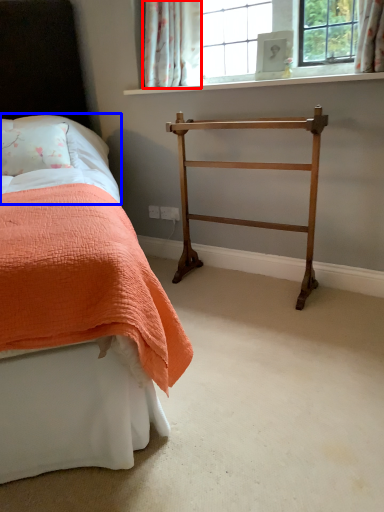
Question: Which object is closer to the camera taking this photo, curtain (highlighted by a red box) or sheet (highlighted by a blue box)?

Choices:
 (A) curtain
 (B) sheet

Answer: (B)